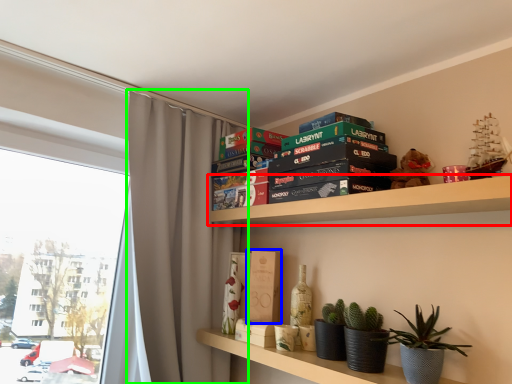
Question: Which is nearer to the shelf (highlighted by a red box)? paperback book (highlighted by a blue box) or curtain (highlighted by a green box).

Choices:
 (A) paperback book
 (B) curtain

Answer: (A)